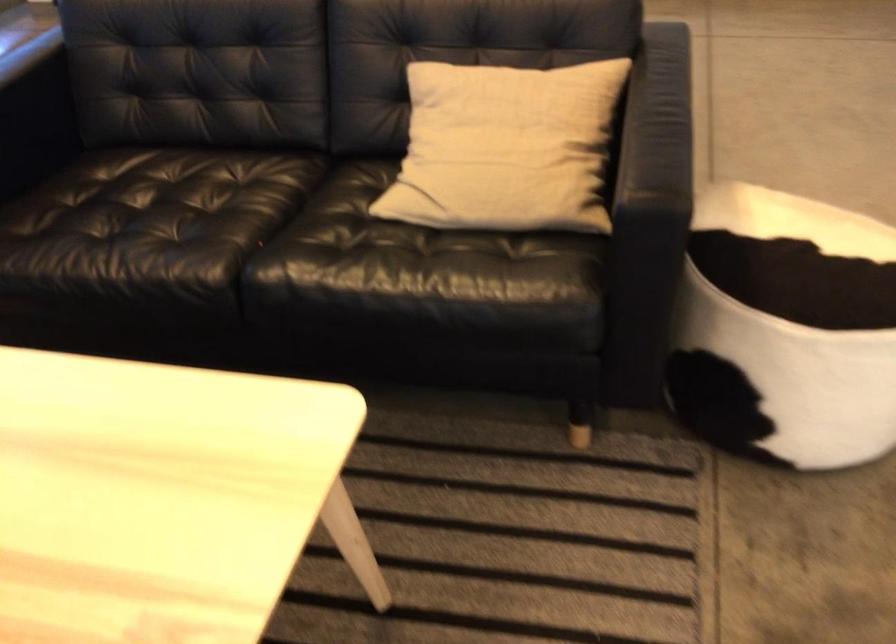
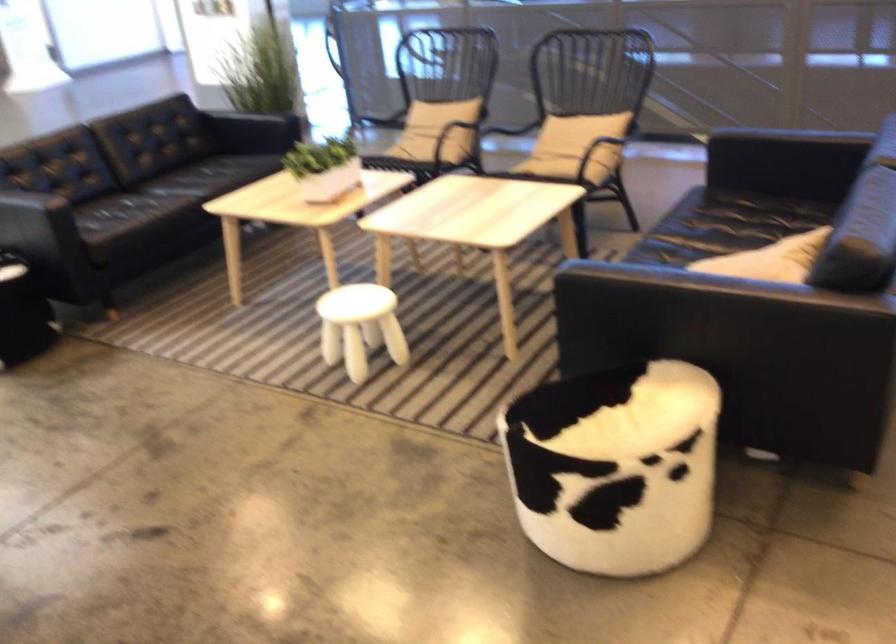
Locate, in the second image, the point that corresponds to pixel 583 78 in the first image.

(770, 259)